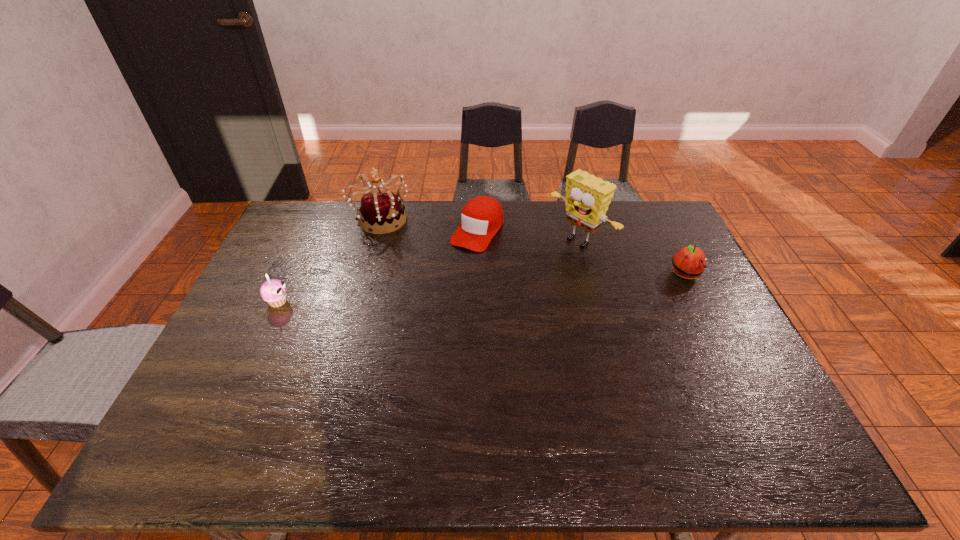
Where is `tiara that is at the far edge`? This screenshot has width=960, height=540. tiara that is at the far edge is located at coordinates (382, 211).

Locate an element on the screen. object present at the left edge is located at coordinates (273, 291).

Where is `object that is positioned at the right edge`? The image size is (960, 540). object that is positioned at the right edge is located at coordinates (689, 262).

Where is `vacant area at the far edge of the desktop`? vacant area at the far edge of the desktop is located at coordinates (538, 216).

Where is `vacant space at the near edge of the desktop`? The image size is (960, 540). vacant space at the near edge of the desktop is located at coordinates (286, 414).

Locate an element on the screen. vacant area at the left edge of the desktop is located at coordinates (238, 332).

This screenshot has height=540, width=960. What are the coordinates of `vacant region at the right edge of the desktop` in the screenshot? It's located at (696, 290).

In the image, there is a desktop. Where is `vacant space at the near left corner`? The image size is (960, 540). vacant space at the near left corner is located at coordinates (231, 398).

This screenshot has width=960, height=540. I want to click on free spot between the sponge and the rightmost object, so click(633, 258).

Where is `vacant space in between the fourth farthest object and the nearest object`? The height and width of the screenshot is (540, 960). vacant space in between the fourth farthest object and the nearest object is located at coordinates (482, 288).